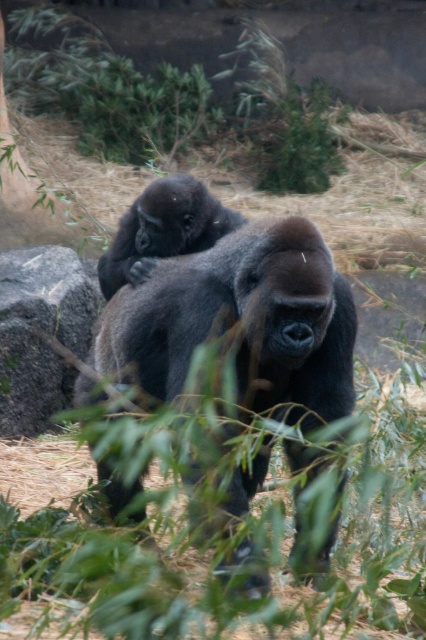
Where is `gray rock at left`? gray rock at left is located at coordinates (43, 330).

Between gray rock at left and dark brown fur at center, which one is positioned lower?

gray rock at left is below.

The width and height of the screenshot is (426, 640). What are the coordinates of `gray rock at left` in the screenshot? It's located at (43, 330).

Who is higher up, green leafy grass at center or dark brown fur at center?

dark brown fur at center

Which is more to the right, green leafy grass at center or dark brown fur at center?

green leafy grass at center

Is point (144, 596) positioned before point (181, 234)?

Yes.

What are the coordinates of `green leafy grass at center` in the screenshot? It's located at (207, 554).

This screenshot has height=640, width=426. What do you see at coordinates (342, 204) in the screenshot? I see `brown grass at center` at bounding box center [342, 204].

The width and height of the screenshot is (426, 640). Find the location of `brown grass at center`. brown grass at center is located at coordinates (342, 204).